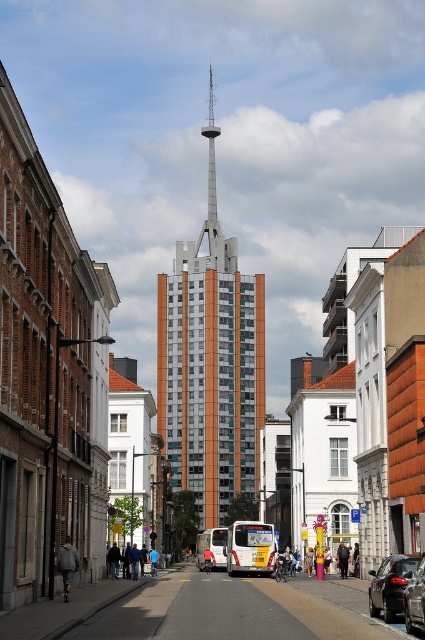
You are a city planner analyzing the image. The green glass tower at center and the shiny black car at lower right are both visible in the scene. Based on their sizes in the image, which object appears wider?

The green glass tower at center appears wider than the shiny black car at lower right because its width surpasses that of the car.

You are a pedestrian standing on the street in the image. You see a point at coordinate [342,560]. What object is located at that point?

The point at coordinate [342,560] corresponds to the light brown leather jacket at center.